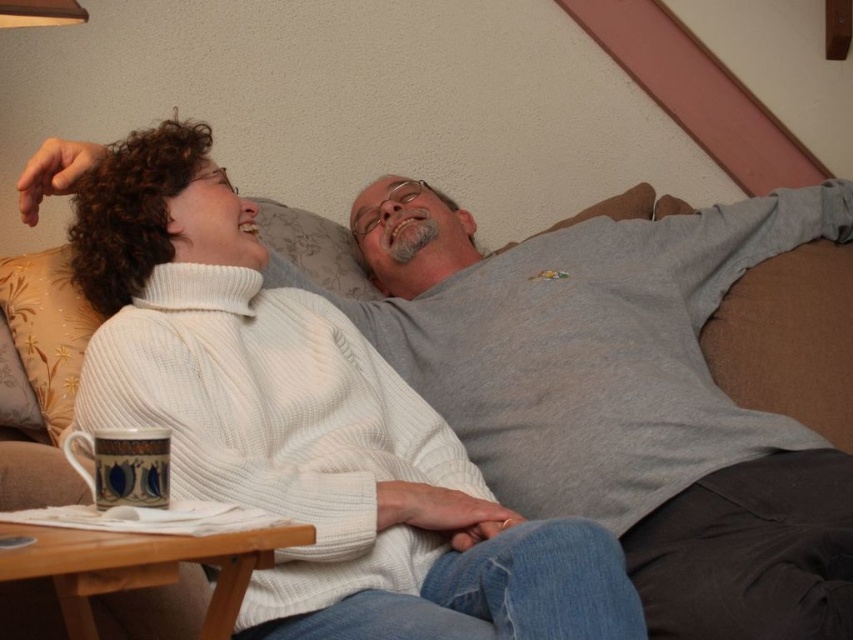
Can you confirm if dark gray fabric at lower right is positioned to the right of blue and white ceramic mug at lower left?

Yes, dark gray fabric at lower right is to the right of blue and white ceramic mug at lower left.

Is dark gray fabric at lower right further to camera compared to blue and white ceramic mug at lower left?

That is True.

Which is in front, point (775, 508) or point (137, 442)?

Point (137, 442) is in front.

Identify the location of dark gray fabric at lower right. (750, 552).